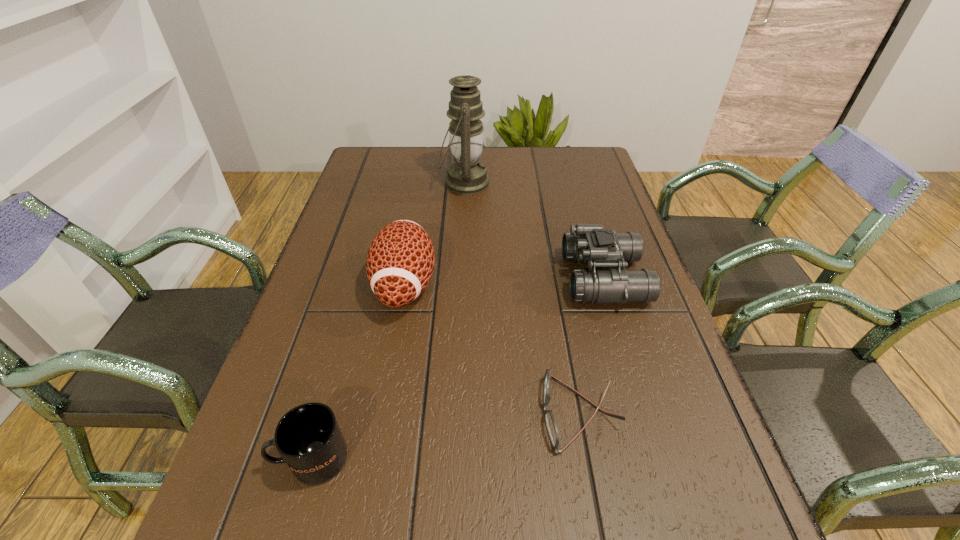
You are a GUI agent. You are given a task and a screenshot of the screen. Output one action in this format:
    pyautogui.click(x=<x>, y=<y>)
    Task: Click on the oil lamp
    
    Given the screenshot: What is the action you would take?
    pyautogui.click(x=467, y=175)

Locate an element on the screen. This screenshot has width=960, height=540. the farthest object is located at coordinates (467, 175).

I want to click on football, so click(x=400, y=261).

At what (x,y) coordinates should I click in order to perform the action: click on binoculars. Please return your answer as a coordinate pair (x, y). This screenshot has height=540, width=960. Looking at the image, I should click on (589, 243).

Identify the location of the fourth tallest object. (308, 437).

Image resolution: width=960 pixels, height=540 pixels. What are the coordinates of `spectacles` in the screenshot? It's located at (552, 429).

Locate an element on the screen. vacant area located on the front of the tallest object is located at coordinates (463, 224).

I want to click on blank space located 0.290m on the back of the football, so click(421, 189).

Where is `free space located through the lenses of the binoculars`? This screenshot has width=960, height=540. free space located through the lenses of the binoculars is located at coordinates (450, 278).

You are a GUI agent. You are given a task and a screenshot of the screen. Output one action in this format:
    pyautogui.click(x=<x>, y=<y>)
    Task: Click on the vacant area situated 0.080m through the lenses of the binoculars
    
    Given the screenshot: What is the action you would take?
    pyautogui.click(x=533, y=278)